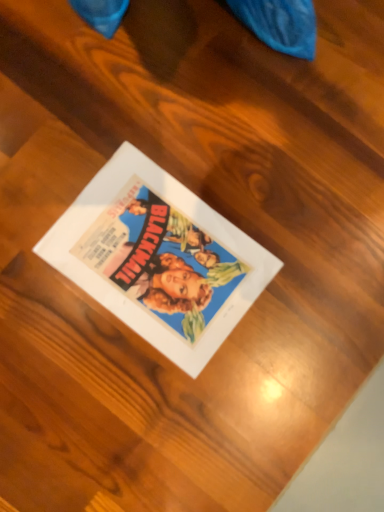
You are a GUI agent. You are given a task and a screenshot of the screen. Output one action in this format:
    pyautogui.click(x=<x>, y=<y>)
    Task: Click on the vacant area that lies to the right of matte paper poster at center
    Image resolution: width=384 pixels, height=512 pixels.
    Given the screenshot: What is the action you would take?
    pyautogui.click(x=306, y=312)